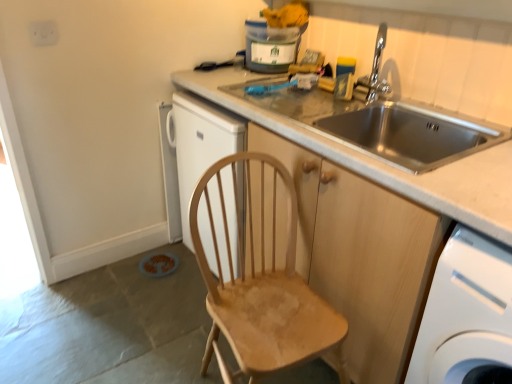
The width and height of the screenshot is (512, 384). I want to click on vacant region above stainless steel sink at upper right (from a real-world perspective), so click(384, 11).